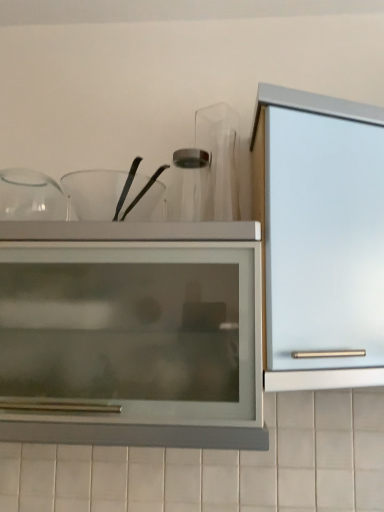
Question: From the image's perspective, is transparent glass bowls at upper center on satin silver cabinet at right?

Choices:
 (A) no
 (B) yes

Answer: (B)

Question: From the image's perspective, does transparent glass bowls at upper center appear lower than satin silver cabinet at right?

Choices:
 (A) no
 (B) yes

Answer: (A)

Question: Is transparent glass bowls at upper center far from satin silver cabinet at right?

Choices:
 (A) yes
 (B) no

Answer: (B)

Question: From a real-world perspective, is transparent glass bowls at upper center located higher than satin silver cabinet at right?

Choices:
 (A) yes
 (B) no

Answer: (A)

Question: Does transparent glass bowls at upper center have a lesser width compared to satin silver cabinet at right?

Choices:
 (A) yes
 (B) no

Answer: (A)

Question: Considering the relative sizes of transparent glass bowls at upper center and satin silver cabinet at right in the image provided, is transparent glass bowls at upper center taller than satin silver cabinet at right?

Choices:
 (A) no
 (B) yes

Answer: (A)

Question: Is matte glass cupboard at center outside of satin silver cabinet at right?

Choices:
 (A) no
 (B) yes

Answer: (B)

Question: Can you confirm if matte glass cupboard at center is wider than satin silver cabinet at right?

Choices:
 (A) yes
 (B) no

Answer: (A)

Question: Considering the relative positions of matte glass cupboard at center and satin silver cabinet at right in the image provided, is matte glass cupboard at center to the right of satin silver cabinet at right from the viewer's perspective?

Choices:
 (A) no
 (B) yes

Answer: (A)

Question: Is satin silver cabinet at right at the back of matte glass cupboard at center?

Choices:
 (A) no
 (B) yes

Answer: (A)

Question: Is matte glass cupboard at center taller than satin silver cabinet at right?

Choices:
 (A) yes
 (B) no

Answer: (B)

Question: From a real-world perspective, does matte glass cupboard at center sit lower than satin silver cabinet at right?

Choices:
 (A) no
 (B) yes

Answer: (B)

Question: From a real-world perspective, is satin silver cabinet at right physically below matte glass cupboard at center?

Choices:
 (A) yes
 (B) no

Answer: (B)